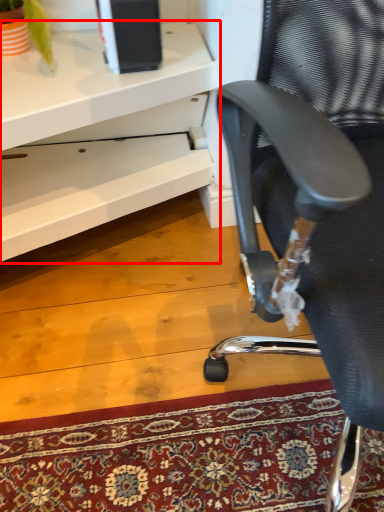
Question: Considering the relative positions of desk (annotated by the red box) and chair in the image provided, where is desk (annotated by the red box) located with respect to the staircase?

Choices:
 (A) right
 (B) left

Answer: (B)